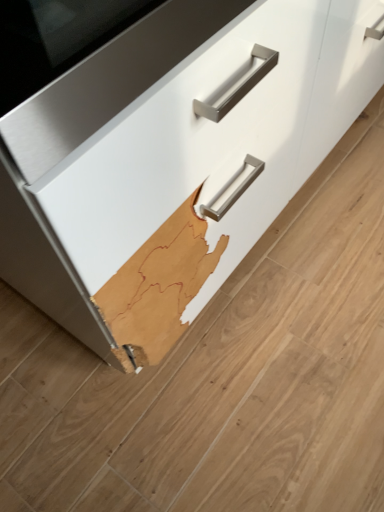
You are a GUI agent. You are given a task and a screenshot of the screen. Output one action in this format:
    pyautogui.click(x=<x>, y=<y>)
    Task: Click on the white glossy drawer at center
    
    Given the screenshot: What is the action you would take?
    pyautogui.click(x=174, y=160)

Describe the element at coordinates (174, 160) in the screenshot. The image size is (384, 512). I see `white glossy drawer at center` at that location.

Find the location of a particular element. white glossy drawer at center is located at coordinates (174, 160).